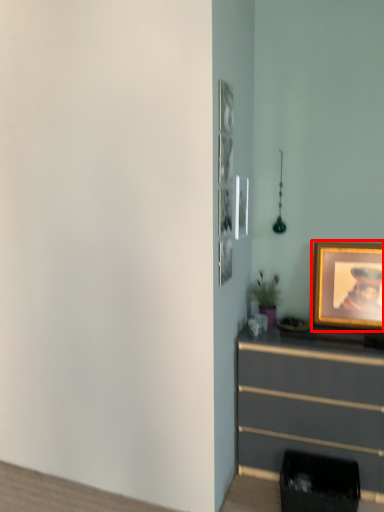
Question: From the image's perspective, where is picture frame (annotated by the red box) located in relation to chest of drawers in the image?

Choices:
 (A) below
 (B) above

Answer: (B)